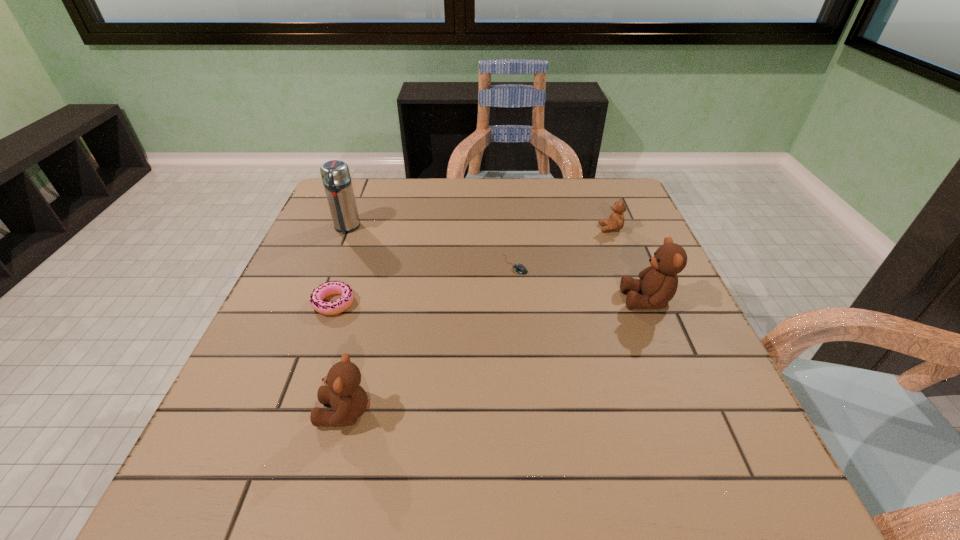
The height and width of the screenshot is (540, 960). Find the location of `vacant space that is in between the shortest object and the fifth shortest object`. vacant space that is in between the shortest object and the fifth shortest object is located at coordinates (581, 282).

Where is `free spot between the nearest object and the doughnut`? The height and width of the screenshot is (540, 960). free spot between the nearest object and the doughnut is located at coordinates (340, 357).

In order to click on vacant area that lies between the fourth nearest object and the fifth shortest object in this screenshot , I will do `click(581, 282)`.

Find the location of `free spot between the fifth tallest object and the nearest object`. free spot between the fifth tallest object and the nearest object is located at coordinates tap(340, 357).

Locate which object ranks fourth in proximity to the thermos bottle. Please provide its 2D coordinates. Your answer should be formatted as a tuple, i.e. [(x, y)], where the tuple contains the x and y coordinates of a point satisfying the conditions above.

[(616, 220)]

Select which object is the fourth closest to the mouse. Please provide its 2D coordinates. Your answer should be formatted as a tuple, i.e. [(x, y)], where the tuple contains the x and y coordinates of a point satisfying the conditions above.

[(335, 174)]

Identify the location of the third closest teddy bear to the tallest object. The width and height of the screenshot is (960, 540). (659, 282).

In order to click on the closest teddy bear to the tallest object in this screenshot , I will do `click(349, 401)`.

Identify the location of free spot that satisfies the following two spatial constraints: 1. with a handle on the side of the tallest object; 2. on the left side of the fifth tallest object. (317, 303).

Identify the location of free space that satisfies the following two spatial constraints: 1. with a handle on the side of the tallest object; 2. on the right side of the third farthest object. (332, 264).